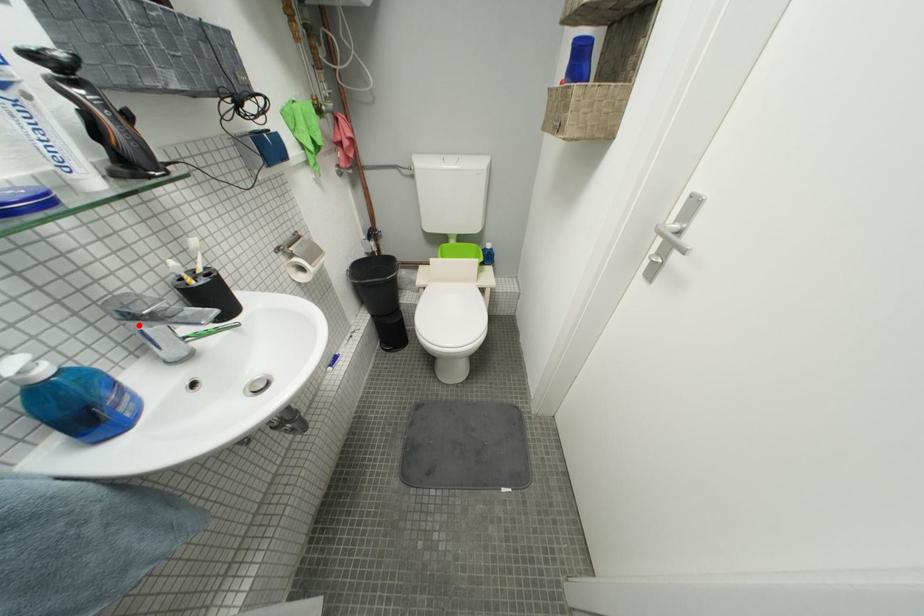
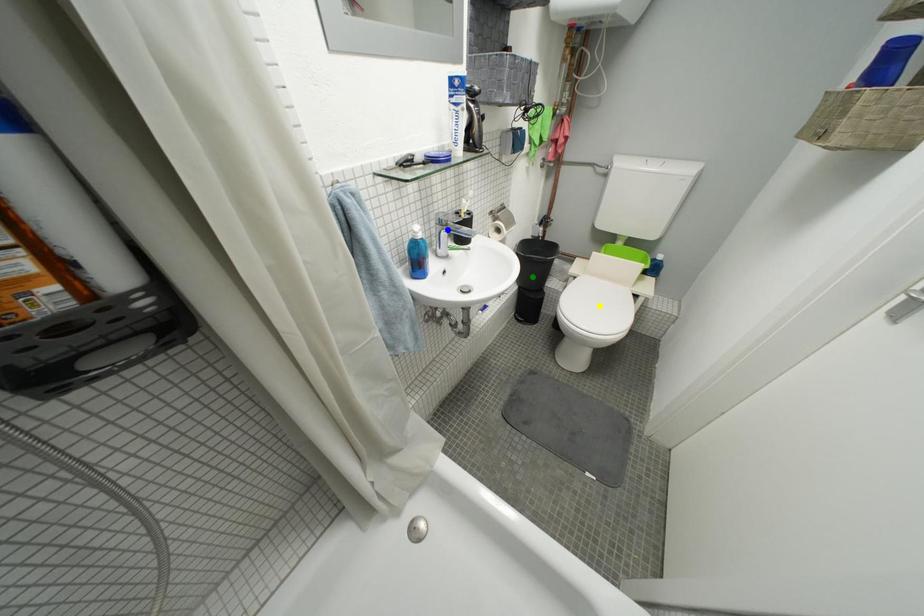
Question: I am providing you with two images of the same scene from different viewpoints. A red point is marked on the first image. You are given multiple points on the second image. Which mark in image 2 goes with the point in image 1?

Choices:
 (A) green point
 (B) yellow point
 (C) blue point

Answer: (C)